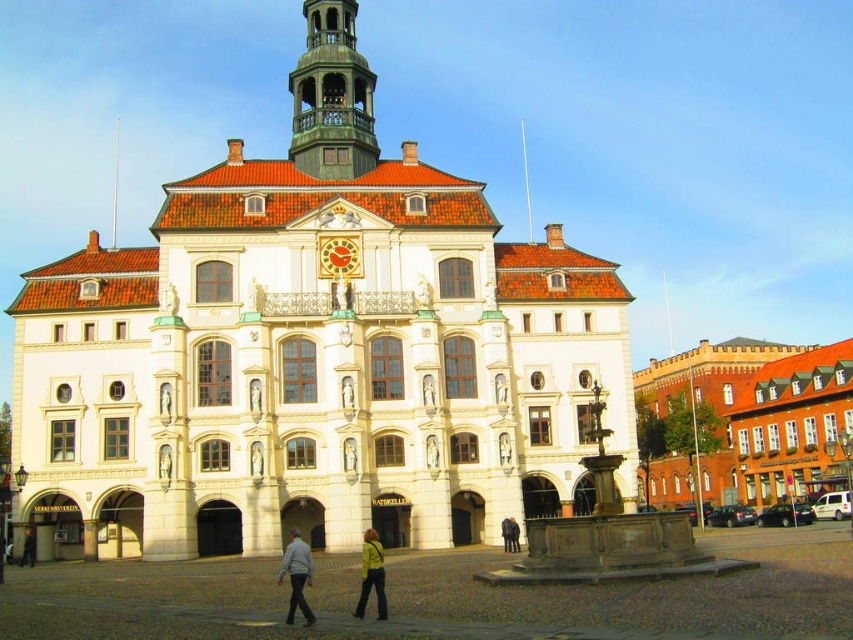
Who is more forward, (363,152) or (358,600)?

Point (358,600) is in front.

Does green wooden bell tower at upper center have a lesser height compared to yellow leather jacket at lower center?

No, green wooden bell tower at upper center is not shorter than yellow leather jacket at lower center.

Which is in front, point (332, 4) or point (373, 538)?

Positioned in front is point (373, 538).

Find the location of a particular element. This screenshot has height=640, width=853. green wooden bell tower at upper center is located at coordinates (331, 97).

Does light gray fabric jacket at lower center have a lesser width compared to green fabric jacket at center?

No, light gray fabric jacket at lower center is not thinner than green fabric jacket at center.

Does point (294, 554) lie in front of point (503, 548)?

Yes, it is in front of point (503, 548).

The height and width of the screenshot is (640, 853). What are the coordinates of `light gray fabric jacket at lower center` in the screenshot? It's located at (296, 577).

Is the position of green wooden bell tower at upper center less distant than that of light gray fabric jacket at lower center?

No, it is not.

Can you confirm if green wooden bell tower at upper center is shorter than light gray fabric jacket at lower center?

No, green wooden bell tower at upper center is not shorter than light gray fabric jacket at lower center.

The height and width of the screenshot is (640, 853). What do you see at coordinates (331, 97) in the screenshot?
I see `green wooden bell tower at upper center` at bounding box center [331, 97].

This screenshot has width=853, height=640. I want to click on green wooden bell tower at upper center, so click(331, 97).